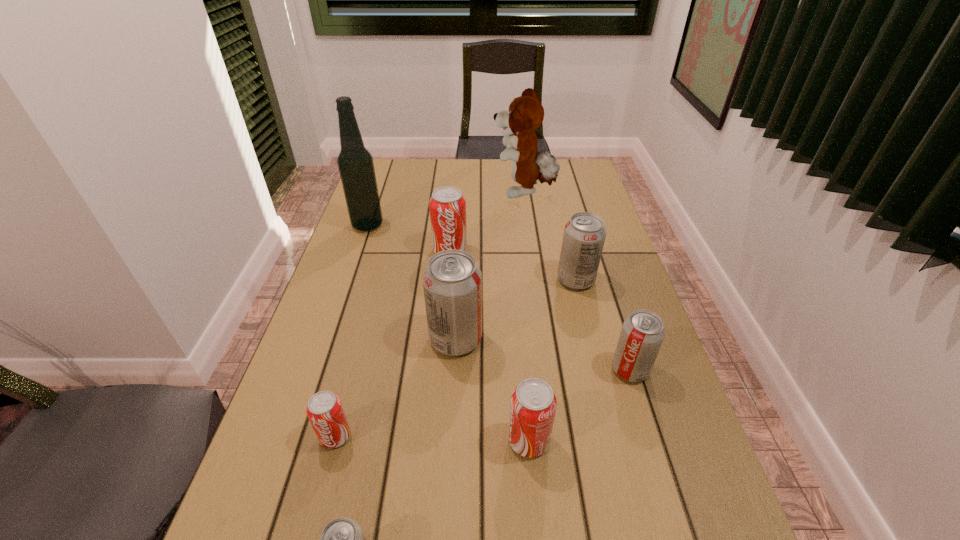
Where is `the second farthest object`? This screenshot has height=540, width=960. the second farthest object is located at coordinates (355, 163).

The width and height of the screenshot is (960, 540). I want to click on alcohol, so click(355, 163).

Locate an element on the screen. This screenshot has height=540, width=960. brown puppy is located at coordinates (525, 114).

Locate an element on the screen. the farthest object is located at coordinates (525, 114).

This screenshot has height=540, width=960. Identify the location of the biggest gray soda can. (452, 282).

Locate an element on the screen. The image size is (960, 540). the tallest soda can is located at coordinates (452, 282).

What are the coordinates of `the farthest soda can` in the screenshot? It's located at (447, 205).

You are a GUI agent. You are given a task and a screenshot of the screen. Output one action in this format:
    pyautogui.click(x=<x>, y=<y>)
    Task: Click on the third farthest object
    The image size is (960, 540).
    Given the screenshot: What is the action you would take?
    pyautogui.click(x=447, y=205)

Where is `the fourth farthest object`? The width and height of the screenshot is (960, 540). the fourth farthest object is located at coordinates (584, 235).

This screenshot has height=540, width=960. What are the coordinates of `the farthest gray soda can` in the screenshot? It's located at (584, 235).